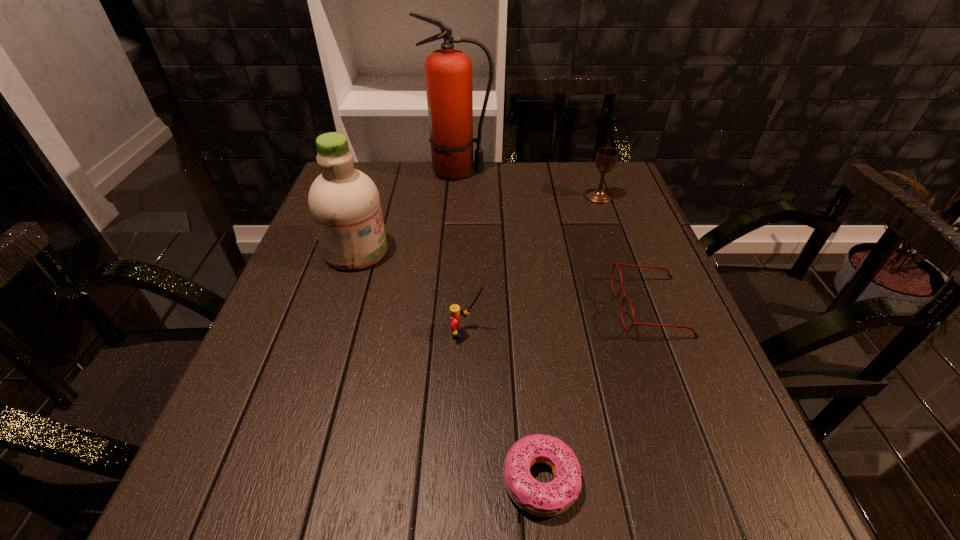
In the image, there is a desktop. Where is `vacant space at the near left corner`? This screenshot has width=960, height=540. vacant space at the near left corner is located at coordinates (269, 494).

At what (x,y) coordinates should I click in order to perform the action: click on unoccupied position between the shortest object and the fourth tallest object. Please return your answer as a coordinate pair (x, y). This screenshot has width=960, height=540. Looking at the image, I should click on (504, 407).

Locate an element on the screen. Image resolution: width=960 pixels, height=540 pixels. unoccupied area between the second shortest object and the fourth shortest object is located at coordinates (625, 252).

This screenshot has width=960, height=540. I want to click on vacant space that's between the nearest object and the leftmost object, so click(448, 366).

I want to click on unoccupied position between the third farthest object and the chalice, so click(x=477, y=224).

Find the location of a particular element. This screenshot has width=960, height=540. vacant area between the spectacles and the shortest object is located at coordinates click(596, 394).

Identify the location of blank region between the fifth tallest object and the cleansing agent. click(504, 279).

Where is `vacant space that is in between the fifth tallest object and the Lego`? This screenshot has height=540, width=960. vacant space that is in between the fifth tallest object and the Lego is located at coordinates (559, 320).

At what (x,y) coordinates should I click in order to perform the action: click on free space between the fire extinguisher and the fifth nearest object. Please return your answer as a coordinate pair (x, y). Looking at the image, I should click on (528, 184).

Where is `vacant space in between the leftmost object and the tallest object`? This screenshot has height=540, width=960. vacant space in between the leftmost object and the tallest object is located at coordinates [407, 212].